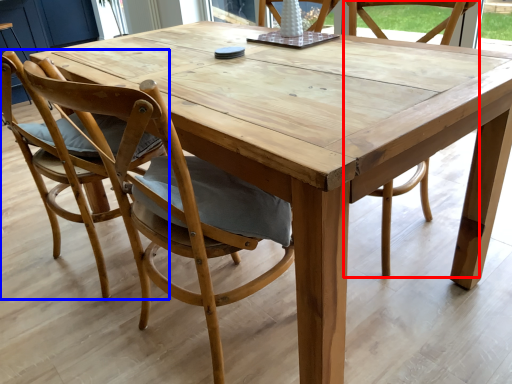
Question: Which object is closer to the camera taking this photo, chair (highlighted by a red box) or chair (highlighted by a blue box)?

Choices:
 (A) chair
 (B) chair

Answer: (B)